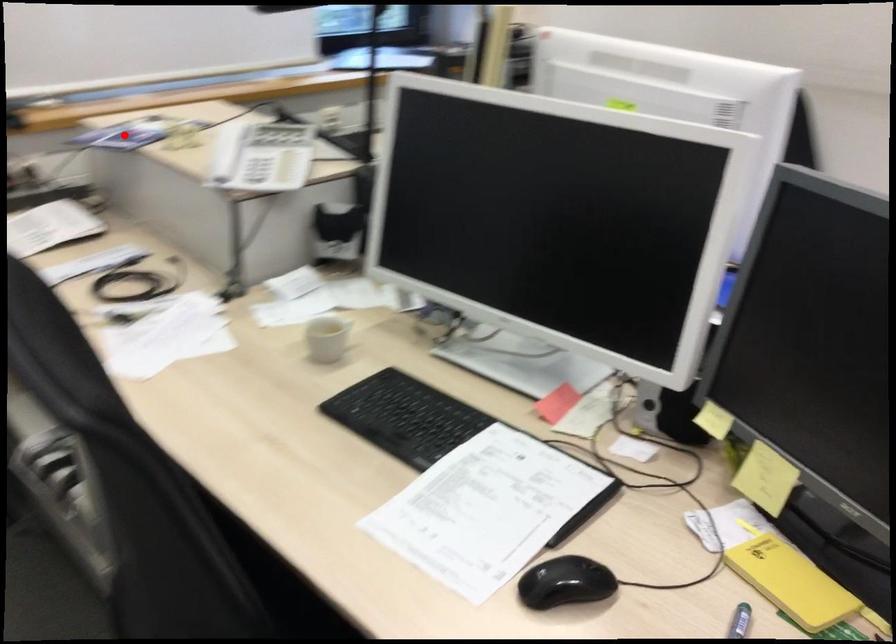
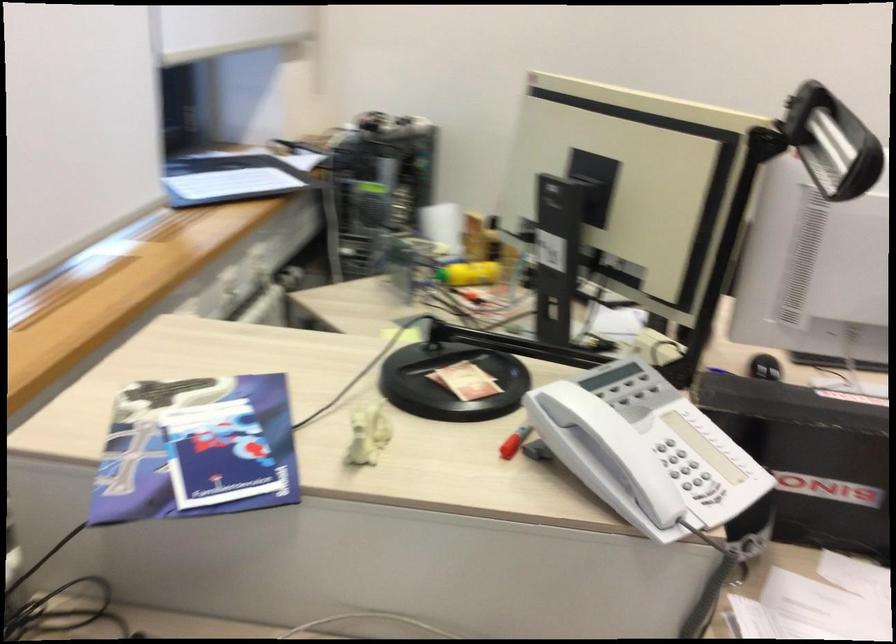
Question: I am providing you with two images of the same scene from different viewpoints. Image1 has a red point marked. In image2, the corresponding 3D location appears at what relative position? Reply with the corresponding letter.

Choices:
 (A) Closer
 (B) Farther

Answer: (A)